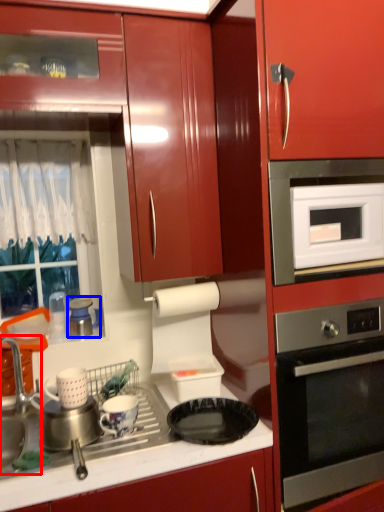
Question: Which of the following is the closest to the observer, sink (highlighted by a red box) or appliance (highlighted by a blue box)?

Choices:
 (A) sink
 (B) appliance

Answer: (A)